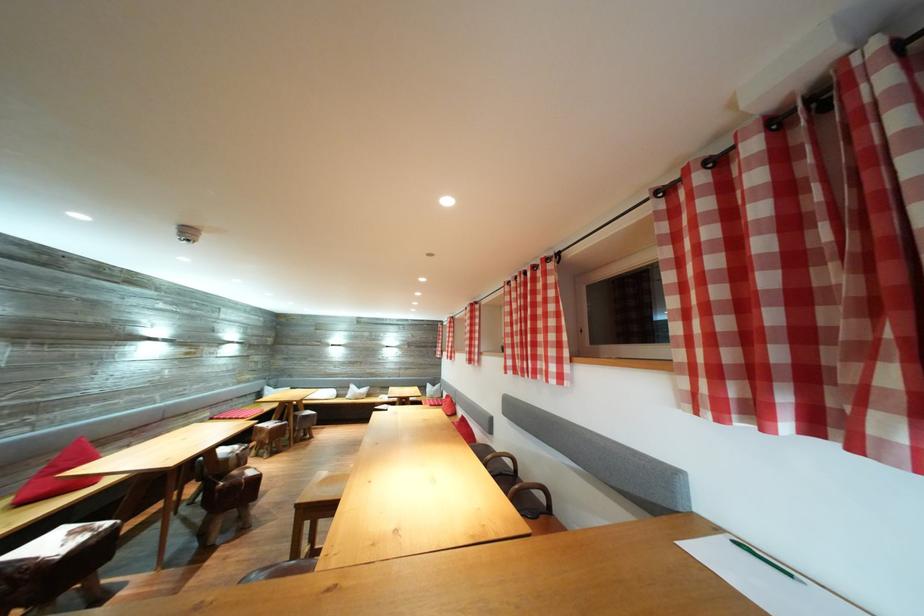
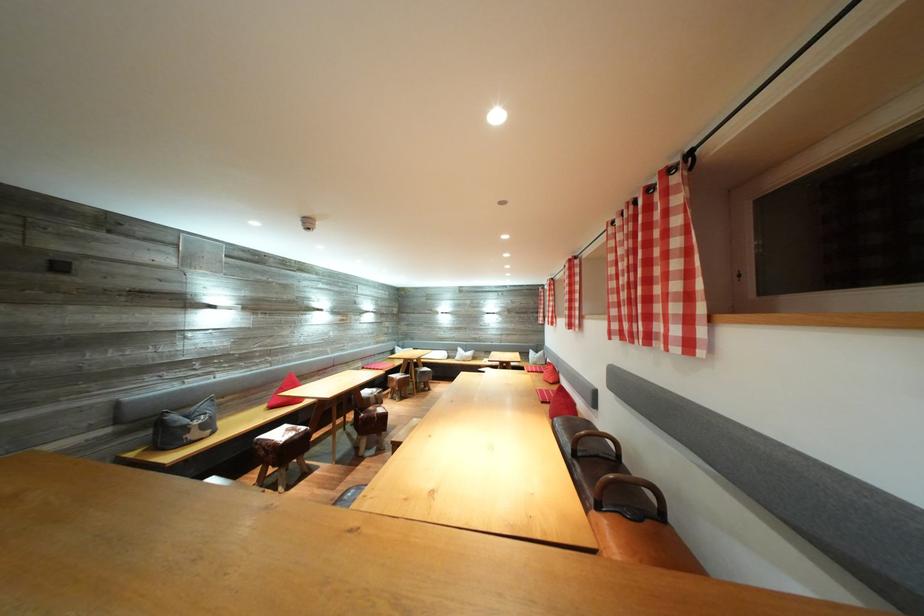
Which direction would the cameraman need to move to produce the second image?

The movement direction of the cameraman is right, forward.